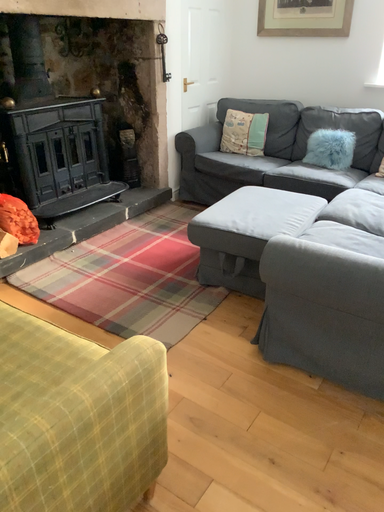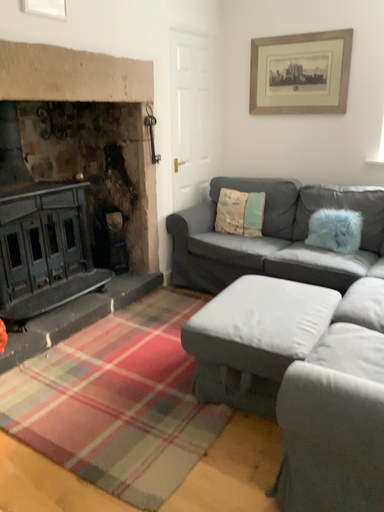
Question: Which way did the camera rotate in the video?

Choices:
 (A) rotated upward
 (B) rotated downward

Answer: (A)